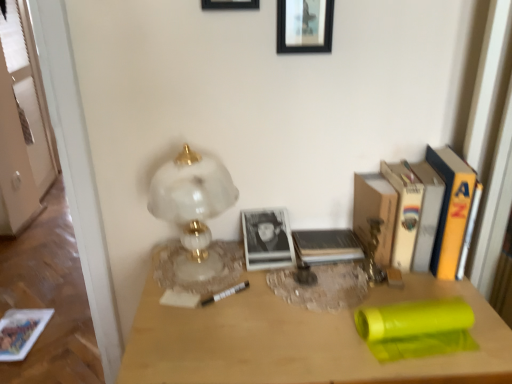
I want to click on free space behind matte paper book at lower left, so click(x=37, y=296).